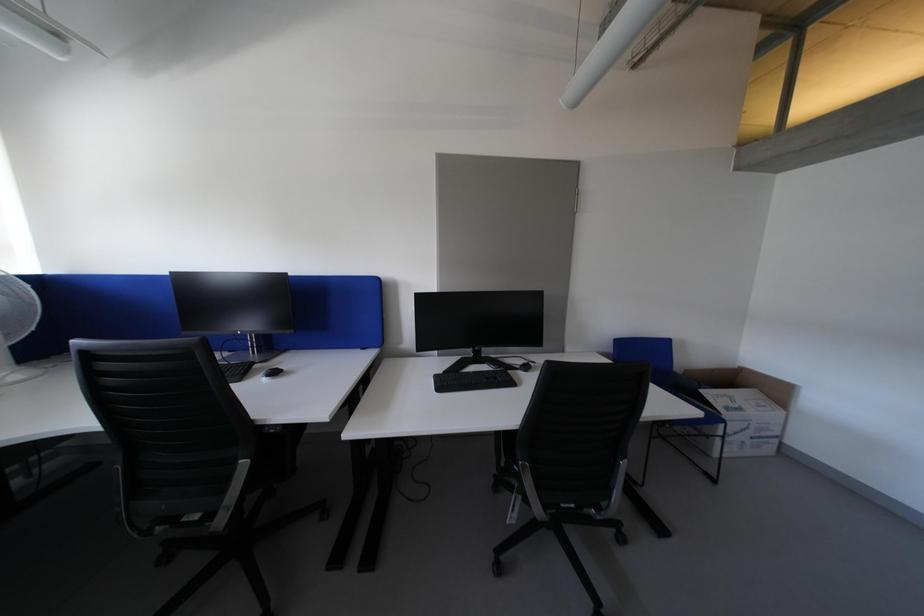
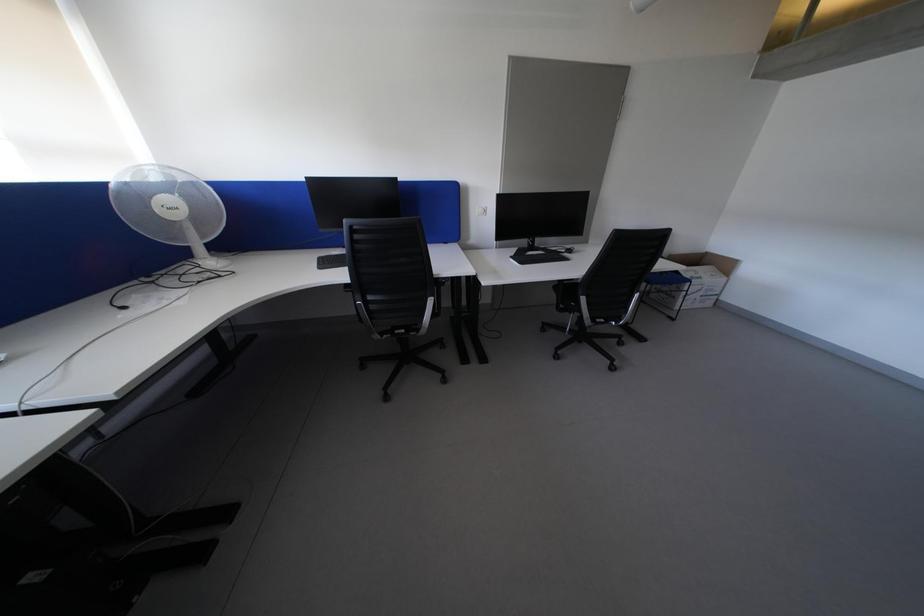
Question: How did the camera likely rotate?

Choices:
 (A) Left
 (B) Right
 (C) Up
 (D) Down

Answer: (D)